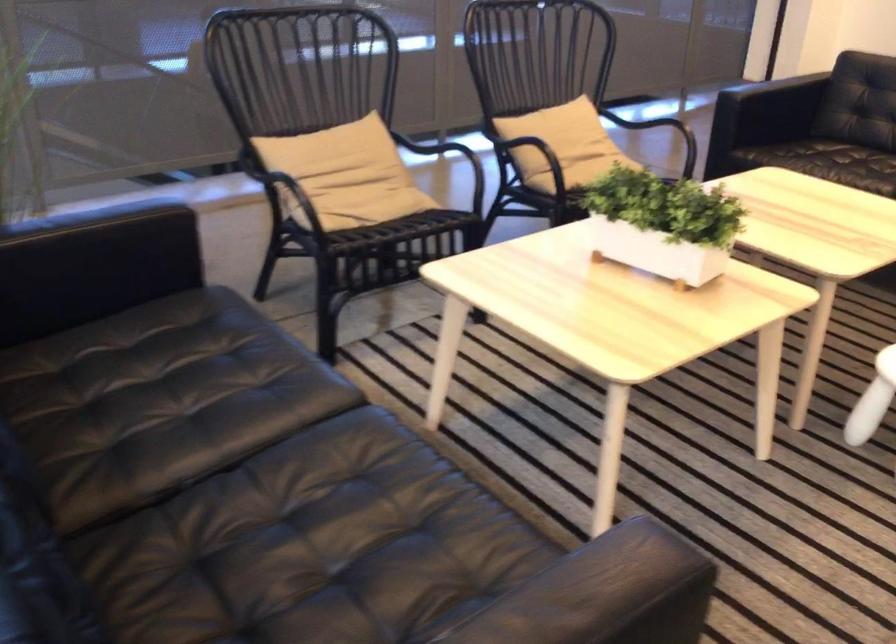
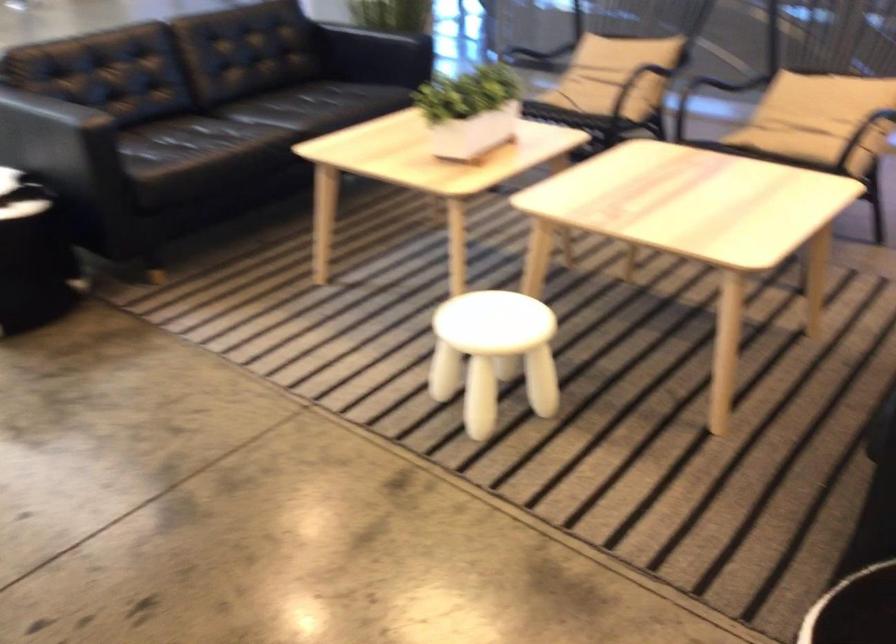
Where in the second image is the point corresponding to [613,144] from the first image?

(817, 118)